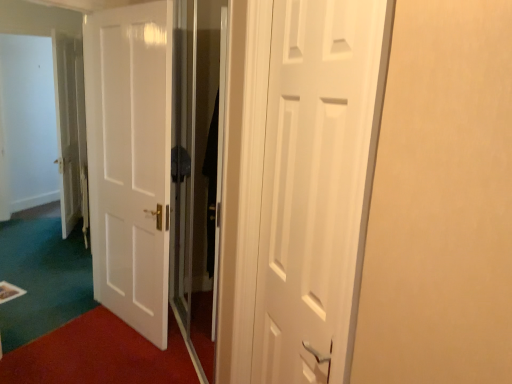
Question: Considering the relative positions of white glossy door at center, marked as the 1th door in a left-to-right arrangement, and white matte door at center, the 2th door viewed from the left, in the image provided, is white glossy door at center, marked as the 1th door in a left-to-right arrangement, behind white matte door at center, the 2th door viewed from the left,?

Choices:
 (A) yes
 (B) no

Answer: (A)

Question: Can you confirm if white glossy door at center, which appears as the first door when viewed from the back, is smaller than white matte door at center, the 2th door viewed from the left?

Choices:
 (A) no
 (B) yes

Answer: (A)

Question: Is white glossy door at center, positioned as the 2th door in front-to-back order, oriented away from white matte door at center, the 2th door viewed from the left?

Choices:
 (A) yes
 (B) no

Answer: (B)

Question: Considering the relative sizes of white glossy door at center, the 2th door positioned from the right, and white matte door at center, marked as the first door in a right-to-left arrangement, in the image provided, is white glossy door at center, the 2th door positioned from the right, bigger than white matte door at center, marked as the first door in a right-to-left arrangement,?

Choices:
 (A) yes
 (B) no

Answer: (A)

Question: Can you confirm if white glossy door at center, marked as the 1th door in a left-to-right arrangement, is wider than white matte door at center, the 2th door viewed from the left?

Choices:
 (A) no
 (B) yes

Answer: (B)

Question: Relative to white matte door at center, the 2th door viewed from the left, is white glossy door at center, the 2th door positioned from the right, in front or behind?

Choices:
 (A) behind
 (B) front

Answer: (A)

Question: Considering the positions of white glossy door at center, marked as the 1th door in a left-to-right arrangement, and white matte door at center, the first door positioned from the front, in the image, is white glossy door at center, marked as the 1th door in a left-to-right arrangement, taller or shorter than white matte door at center, the first door positioned from the front,?

Choices:
 (A) short
 (B) tall

Answer: (B)

Question: Looking at the image, does white glossy door at center, which appears as the first door when viewed from the back, seem bigger or smaller compared to white matte door at center, the 2th door viewed from the left?

Choices:
 (A) small
 (B) big

Answer: (B)

Question: Considering the positions of white glossy door at center, which appears as the first door when viewed from the back, and white matte door at center, the first door positioned from the front, in the image, is white glossy door at center, which appears as the first door when viewed from the back, wider or thinner than white matte door at center, the first door positioned from the front,?

Choices:
 (A) wide
 (B) thin

Answer: (A)

Question: From a real-world perspective, is transparent glass screen door at center above or below white glossy door at center, the 2th door positioned from the right?

Choices:
 (A) below
 (B) above

Answer: (B)

Question: Is point (203, 241) closer or farther from the camera than point (124, 59)?

Choices:
 (A) farther
 (B) closer

Answer: (A)

Question: Is transparent glass screen door at center wider or thinner than white glossy door at center, positioned as the 2th door in front-to-back order?

Choices:
 (A) thin
 (B) wide

Answer: (A)

Question: Considering the relative positions of transparent glass screen door at center and white glossy door at center, marked as the 1th door in a left-to-right arrangement, in the image provided, is transparent glass screen door at center to the left or to the right of white glossy door at center, marked as the 1th door in a left-to-right arrangement,?

Choices:
 (A) right
 (B) left

Answer: (A)

Question: Is transparent glass screen door at center taller or shorter than white matte door at center, the 2th door viewed from the left?

Choices:
 (A) tall
 (B) short

Answer: (A)

Question: From a real-world perspective, is transparent glass screen door at center physically located above or below white matte door at center, marked as the first door in a right-to-left arrangement?

Choices:
 (A) above
 (B) below

Answer: (B)